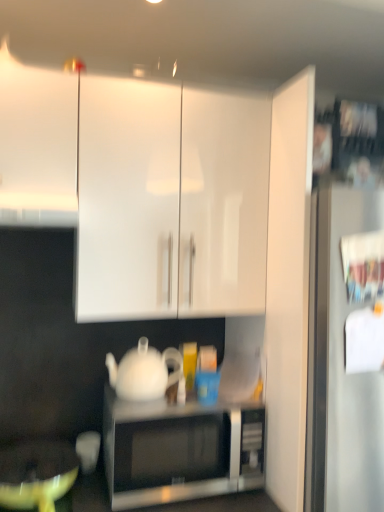
Question: Are matte yellow mixing bowl at lower left and white glossy cabinet at upper center, the second cabinetry from the left, located far from each other?

Choices:
 (A) no
 (B) yes

Answer: (A)

Question: Is matte yellow mixing bowl at lower left beside white glossy cabinet at upper center, the second cabinetry from the left?

Choices:
 (A) yes
 (B) no

Answer: (B)

Question: Is matte yellow mixing bowl at lower left facing towards white glossy cabinet at upper center, which appears as the 1th cabinetry when viewed from the right?

Choices:
 (A) no
 (B) yes

Answer: (A)

Question: Can you confirm if matte yellow mixing bowl at lower left is taller than white glossy cabinet at upper center, which appears as the 1th cabinetry when viewed from the right?

Choices:
 (A) no
 (B) yes

Answer: (A)

Question: Does matte yellow mixing bowl at lower left appear on the right side of white glossy cabinet at upper center, the second cabinetry from the left?

Choices:
 (A) yes
 (B) no

Answer: (B)

Question: Looking at their shapes, would you say sleek silver microwave at center is wider or thinner than white glossy cabinet at upper center, which appears as the 1th cabinetry when viewed from the right?

Choices:
 (A) thin
 (B) wide

Answer: (A)

Question: Would you say sleek silver microwave at center is to the left or to the right of white glossy cabinet at upper center, the second cabinetry from the left, in the picture?

Choices:
 (A) right
 (B) left

Answer: (A)

Question: Is sleek silver microwave at center inside or outside of white glossy cabinet at upper center, which appears as the 1th cabinetry when viewed from the right?

Choices:
 (A) outside
 (B) inside

Answer: (A)

Question: From a real-world perspective, is sleek silver microwave at center positioned above or below white glossy cabinet at upper center, which appears as the 1th cabinetry when viewed from the right?

Choices:
 (A) below
 (B) above

Answer: (A)

Question: Is matte yellow mixing bowl at lower left taller or shorter than sleek silver microwave at center?

Choices:
 (A) tall
 (B) short

Answer: (B)

Question: From the image's perspective, is matte yellow mixing bowl at lower left located above or below sleek silver microwave at center?

Choices:
 (A) above
 (B) below

Answer: (B)

Question: From a real-world perspective, relative to sleek silver microwave at center, is matte yellow mixing bowl at lower left vertically above or below?

Choices:
 (A) below
 (B) above

Answer: (A)

Question: Based on their sizes in the image, would you say matte yellow mixing bowl at lower left is bigger or smaller than sleek silver microwave at center?

Choices:
 (A) big
 (B) small

Answer: (B)

Question: From the image's perspective, is white glossy cabinet at upper center, which appears as the 1th cabinetry when viewed from the right, located above or below white glossy cabinet at upper left, which ranks as the 2th cabinetry in right-to-left order?

Choices:
 (A) below
 (B) above

Answer: (A)

Question: Choose the correct answer: Is white glossy cabinet at upper center, the second cabinetry from the left, inside white glossy cabinet at upper left, the 1th cabinetry viewed from the left, or outside it?

Choices:
 (A) outside
 (B) inside

Answer: (A)